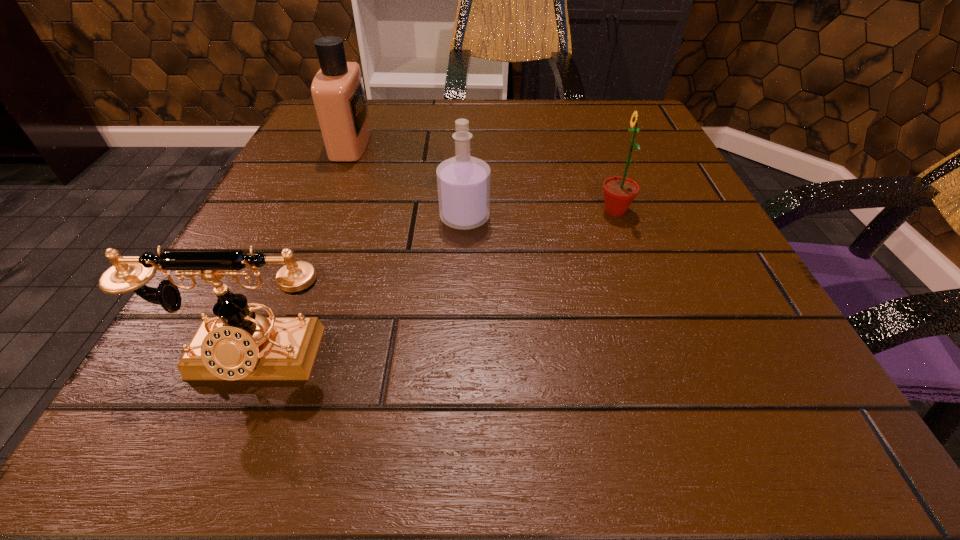
Where is `free space that satisfies the following two spatial constraints: 1. on the front label of the farther perfume; 2. on the left side of the nearer perfume`? The image size is (960, 540). free space that satisfies the following two spatial constraints: 1. on the front label of the farther perfume; 2. on the left side of the nearer perfume is located at coordinates point(320,218).